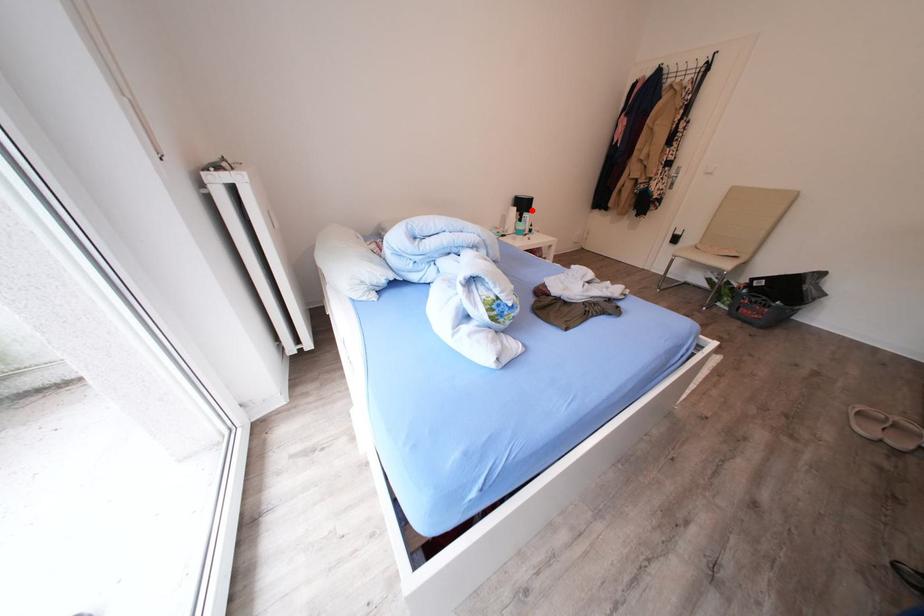
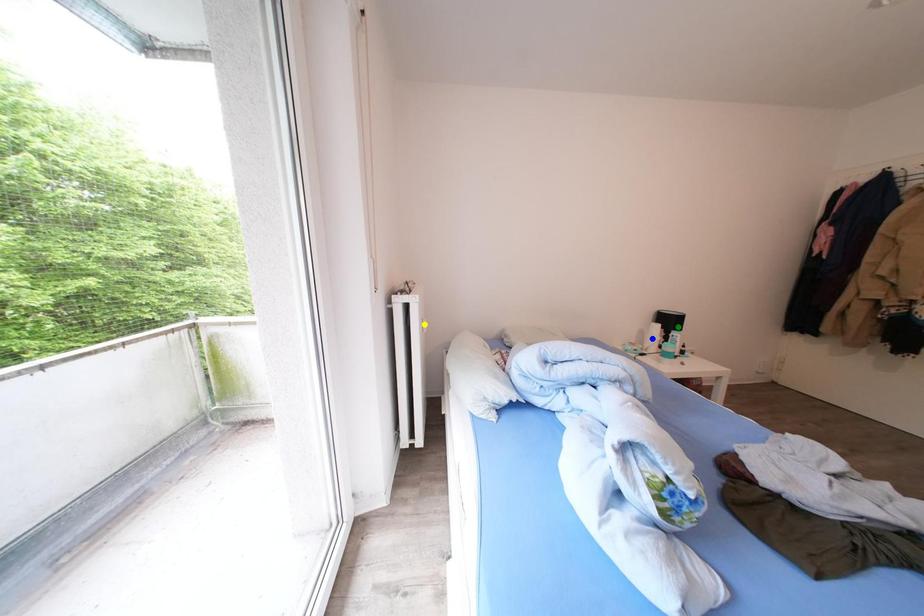
Question: I am providing you with two images of the same scene from different viewpoints. A red point is marked on the first image. You are given multiple points on the second image. Which spot in image 2 lines up with the point in image 1?

Choices:
 (A) yellow point
 (B) blue point
 (C) green point

Answer: (C)